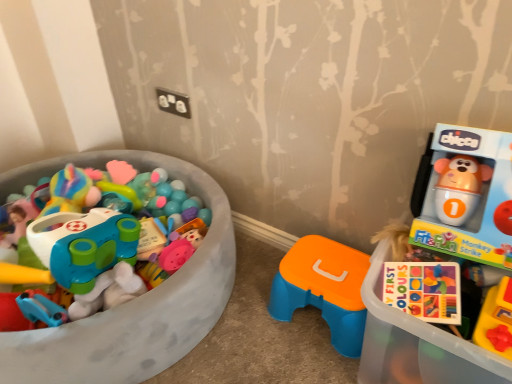
Question: From the image's perspective, is matte plastic toy car at left, which appears as the first toy when viewed from the left, above or below matte plastic toy at right?

Choices:
 (A) below
 (B) above

Answer: (B)

Question: Based on their sizes in the image, would you say matte plastic toy car at left, which appears as the first toy when viewed from the left, is bigger or smaller than matte plastic toy at right?

Choices:
 (A) small
 (B) big

Answer: (B)

Question: Considering the real-world distances, which object is farthest from the matte plastic toy at right?

Choices:
 (A) matte plastic toy car at left, the 2th toy in the right-to-left sequence
 (B) orange plastic stool at center, the first toy positioned from the right

Answer: (A)

Question: Which object is the closest to the matte plastic toy at right?

Choices:
 (A) orange plastic stool at center, the first toy positioned from the right
 (B) matte plastic toy car at left, which appears as the first toy when viewed from the left

Answer: (A)